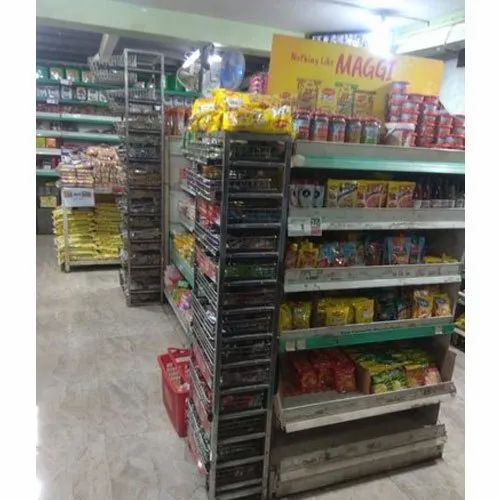
You are a GUI agent. You are given a task and a screenshot of the screen. Output one action in this format:
    pyautogui.click(x=<x>, y=<y>)
    Task: Click on the floor
    Image resolution: width=500 pixels, height=500 pixels.
    Given the screenshot: What is the action you would take?
    pyautogui.click(x=96, y=349)